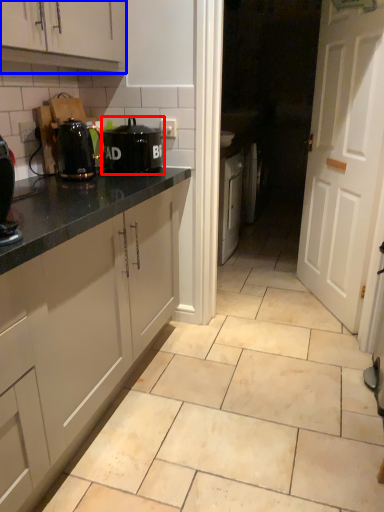
Question: Which point is further to the camera, home appliance (highlighted by a red box) or cabinetry (highlighted by a blue box)?

Choices:
 (A) home appliance
 (B) cabinetry

Answer: (A)